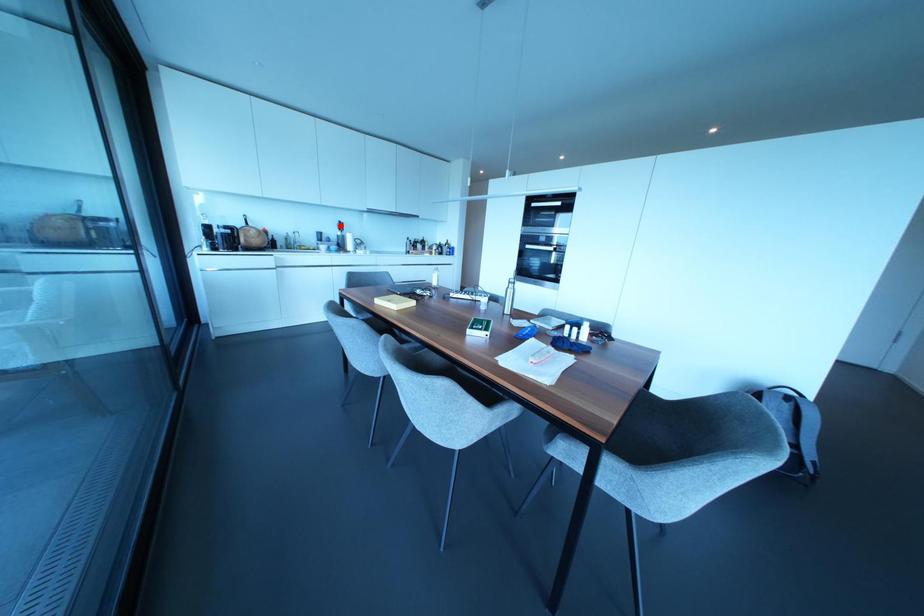
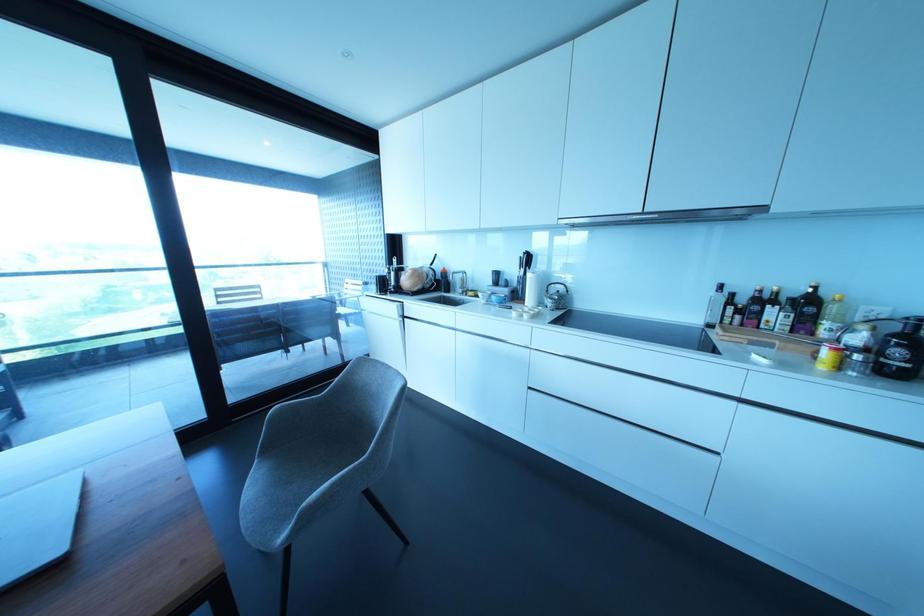
In the second image, find the point that corresponds to the highlighted location in the first image.

(527, 259)